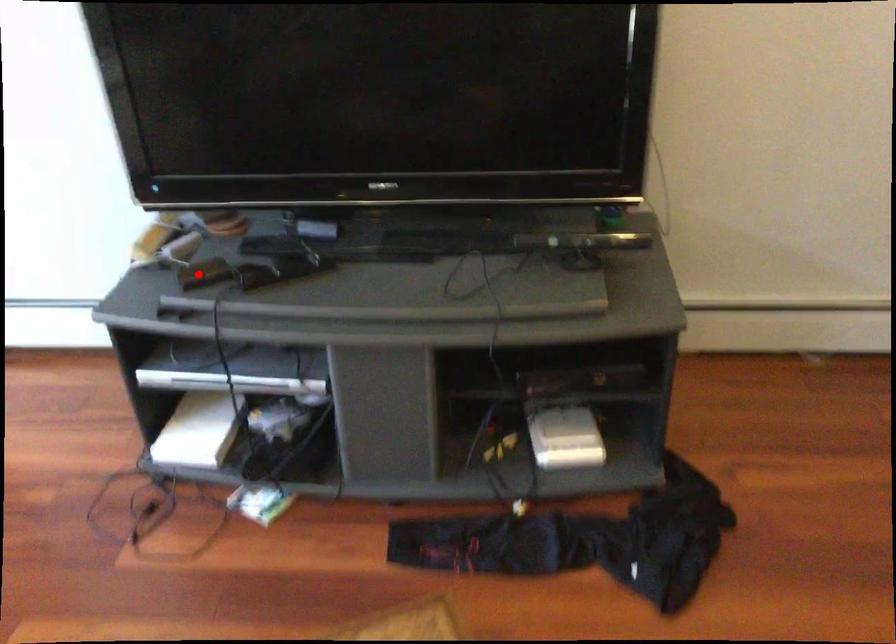
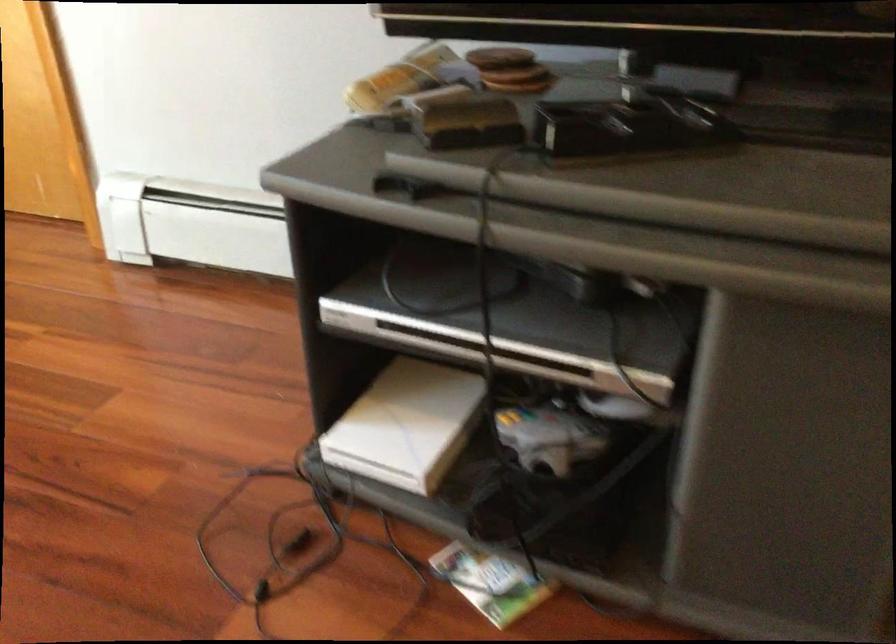
Question: I am providing you with two images of the same scene from different viewpoints. In image1, a red point is highlighted. Considering the same 3D point in image2, which of the following is correct?

Choices:
 (A) It is closer
 (B) It is farther

Answer: (A)